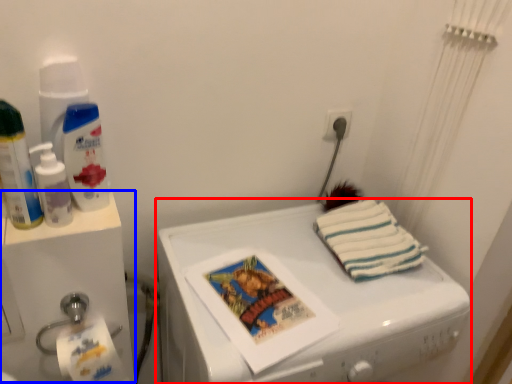
Question: Which object is closer to the camera taking this photo, machine (highlighted by a red box) or water cooler (highlighted by a blue box)?

Choices:
 (A) machine
 (B) water cooler

Answer: (A)